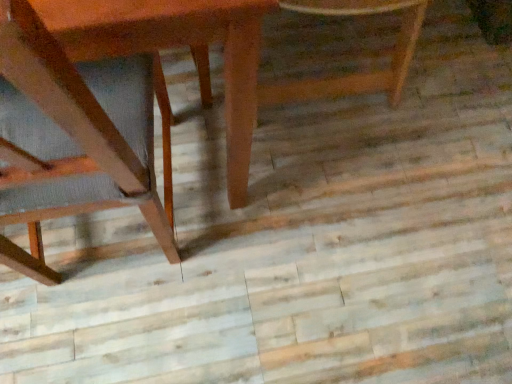
Question: Is wooden chair at left, placed as the second chair when sorted from right to left, spatially inside wooden table at left, or outside of it?

Choices:
 (A) outside
 (B) inside

Answer: (B)

Question: From the image's perspective, is wooden chair at left, which is the first chair from left to right, positioned above or below wooden table at left?

Choices:
 (A) above
 (B) below

Answer: (B)

Question: Which object is positioned closest to the wooden table at left?

Choices:
 (A) wooden chair at left, which is the first chair from left to right
 (B) wooden chair at center, the 2th chair positioned from the left

Answer: (A)

Question: Considering the real-world distances, which object is closest to the wooden table at left?

Choices:
 (A) wooden chair at center, the 1th chair when ordered from right to left
 (B) wooden chair at left, which is the first chair from left to right

Answer: (B)